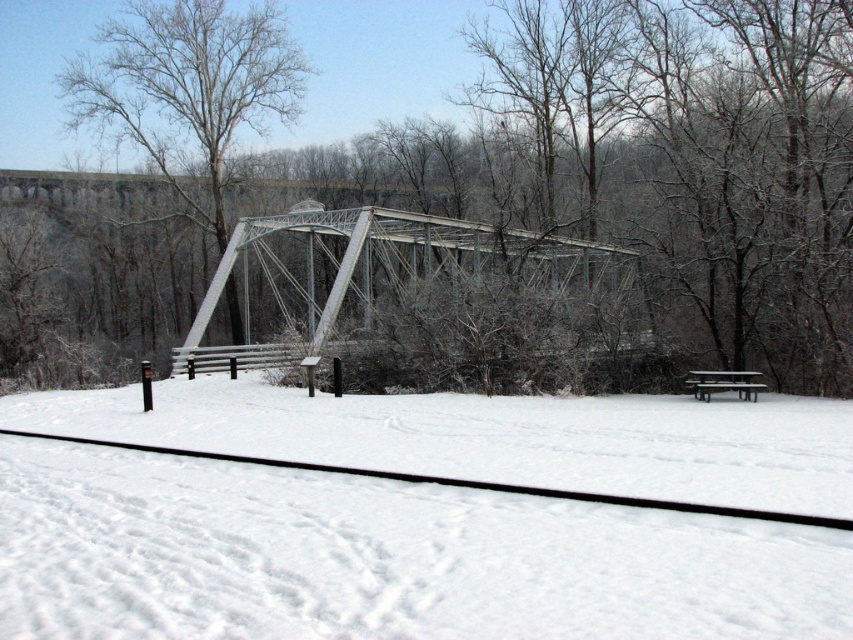
Question: Does bare wood tree at upper center appear on the left side of metallic gray bridge at center?

Choices:
 (A) yes
 (B) no

Answer: (A)

Question: Which object is closer to the camera taking this photo?

Choices:
 (A) black rubber train track at lower center
 (B) bare wood tree at upper center

Answer: (A)

Question: Considering the relative positions of white snow at center and bare wood tree at upper center in the image provided, where is white snow at center located with respect to bare wood tree at upper center?

Choices:
 (A) below
 (B) above

Answer: (A)

Question: Which point is farther to the camera?

Choices:
 (A) bare wood tree at upper center
 (B) metallic gray bridge at center

Answer: (A)

Question: Does bare wood tree at upper center have a greater width compared to black rubber train track at lower center?

Choices:
 (A) yes
 (B) no

Answer: (A)

Question: Which object appears farthest from the camera in this image?

Choices:
 (A) wooden picnic table at lower right
 (B) white snow at center

Answer: (A)